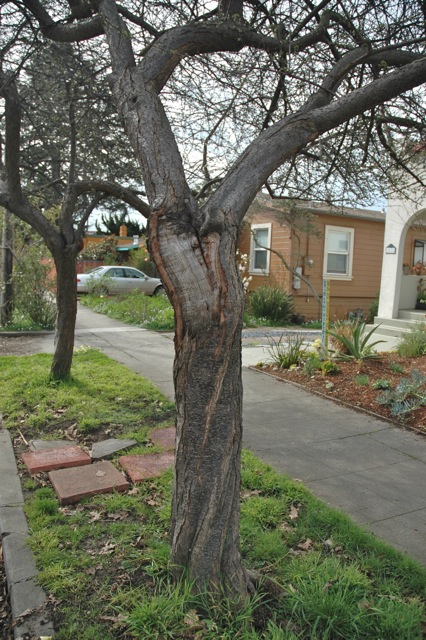
What are the coordinates of `window` in the screenshot? It's located at (334, 244), (339, 262), (262, 234), (261, 260), (418, 250).